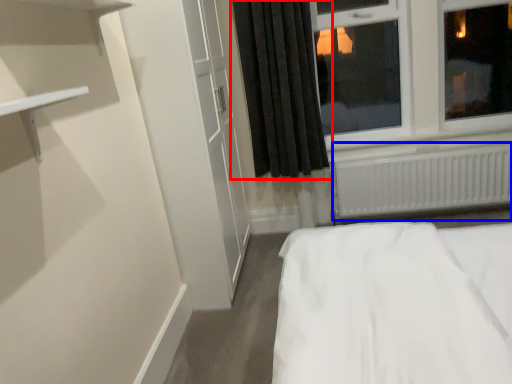
Question: Which of the following is the closest to the observer, curtain (highlighted by a red box) or radiator (highlighted by a blue box)?

Choices:
 (A) curtain
 (B) radiator

Answer: (A)